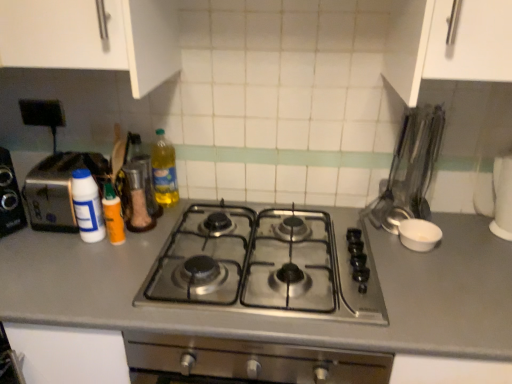
I want to click on vacant space that is to the left of translucent orange bottle at center left, which appears as the second bottle when viewed from the left, so click(x=48, y=246).